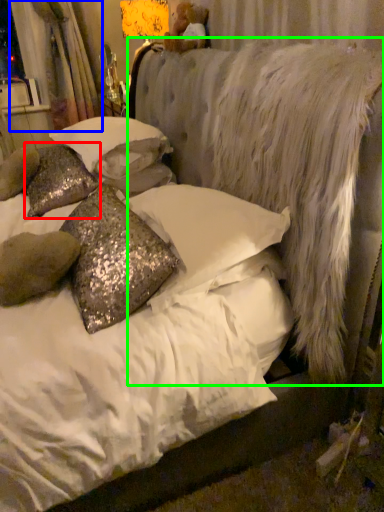
Question: Which object is positioned closest to pillow (highlighted by a red box)? Select from curtain (highlighted by a blue box) and mattress (highlighted by a green box).

Choices:
 (A) curtain
 (B) mattress

Answer: (B)